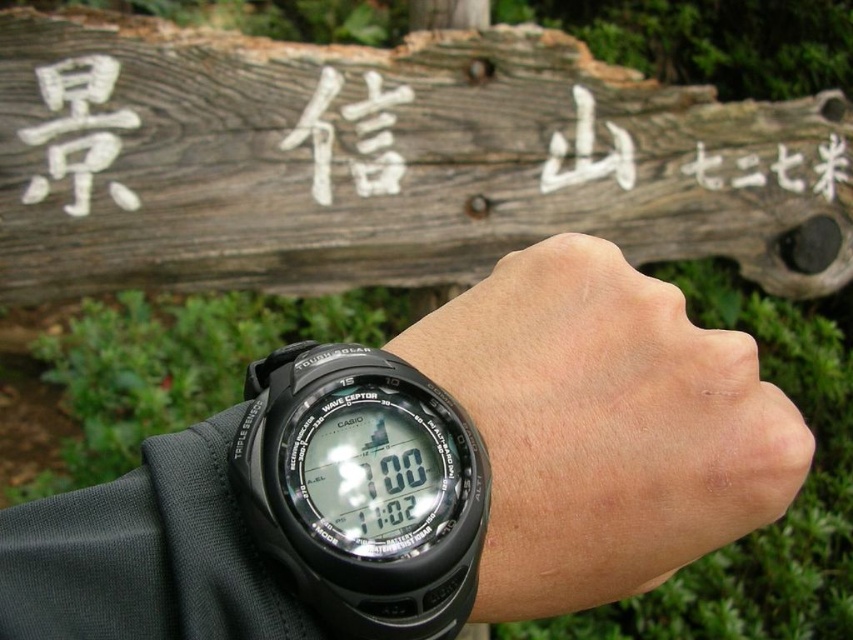
From the picture: You are a hiker who just arrived at a trailhead and noticed a wooden sign with Japanese characters in the background. You need to check your watch to confirm the time. Where exactly on the image should you look to see the black rubber watch at lower center?

You should look at point (604, 426) to see the black rubber watch at lower center.

You are a hiker planning to navigate through a forest trail. You notice a weathered wood sign at upper center and a black rubber watch at lower center in your view. Which object would block your view of the other if they were in the same line of sight?

The weathered wood sign at upper center is bigger than the black rubber watch at lower center, so if they were in the same line of sight, the weathered wood sign at upper center would block the view of the black rubber watch at lower center.

You are a hiker who just arrived at a trailhead and notices the weathered wood sign at upper center and the black rubber watch at lower center. Which object is wider?

The weathered wood sign at upper center is wider than the black rubber watch at lower center.